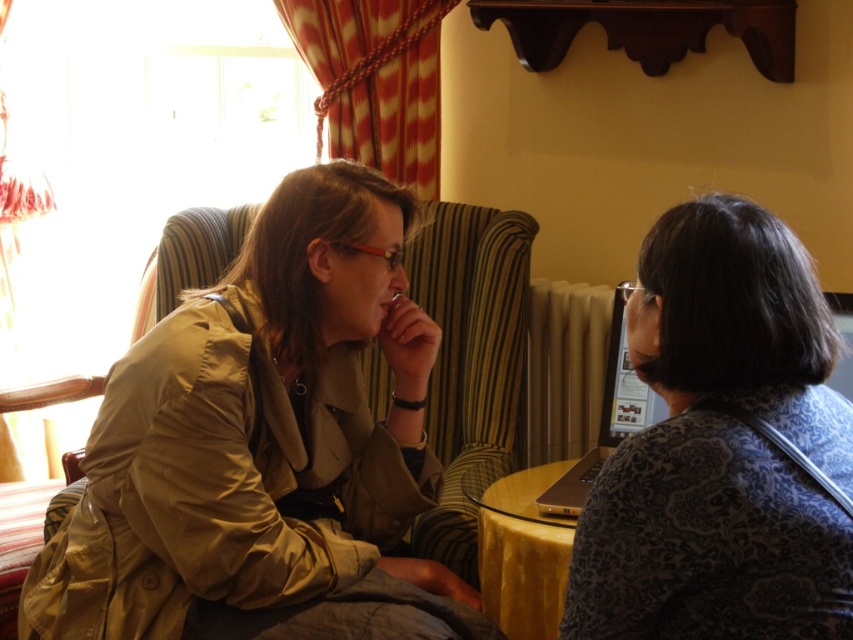
Question: Considering the real-world distances, which object is closest to the patterned fabric shirt at right?

Choices:
 (A) matte khaki trench coat at left
 (B) yellow glass table at center

Answer: (B)

Question: Is patterned fabric shirt at right below yellow glass table at center?

Choices:
 (A) yes
 (B) no

Answer: (B)

Question: Considering the real-world distances, which object is closest to the matte khaki trench coat at left?

Choices:
 (A) patterned fabric shirt at right
 (B) yellow glass table at center

Answer: (B)

Question: Can you confirm if matte khaki trench coat at left is bigger than patterned fabric shirt at right?

Choices:
 (A) no
 (B) yes

Answer: (B)

Question: Which object is farther from the camera taking this photo?

Choices:
 (A) patterned fabric shirt at right
 (B) yellow glass table at center
 (C) matte khaki trench coat at left

Answer: (B)

Question: Does matte khaki trench coat at left appear over patterned fabric shirt at right?

Choices:
 (A) no
 (B) yes

Answer: (A)